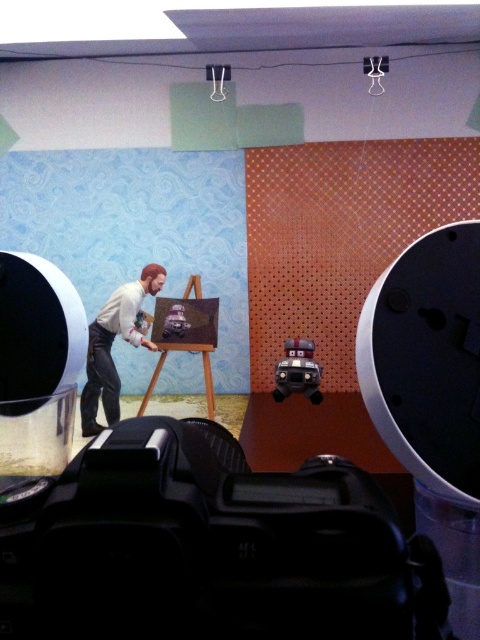
Question: Which point is closer to the camera?

Choices:
 (A) wooden easel at center
 (B) matte black video camera at center
 (C) smooth beige shirt at center

Answer: (B)

Question: Does smooth beige shirt at center have a greater width compared to matte black video camera at center?

Choices:
 (A) no
 (B) yes

Answer: (B)

Question: Among these objects, which one is farthest from the camera?

Choices:
 (A) smooth beige shirt at center
 (B) matte black video camera at center
 (C) wooden easel at center

Answer: (C)

Question: Considering the real-world distances, which object is farthest from the wooden easel at center?

Choices:
 (A) smooth beige shirt at center
 (B) matte black video camera at center

Answer: (B)

Question: Where is smooth beige shirt at center located in relation to matte black video camera at center in the image?

Choices:
 (A) above
 (B) below

Answer: (A)

Question: Can you confirm if smooth beige shirt at center is positioned to the left of wooden easel at center?

Choices:
 (A) no
 (B) yes

Answer: (B)